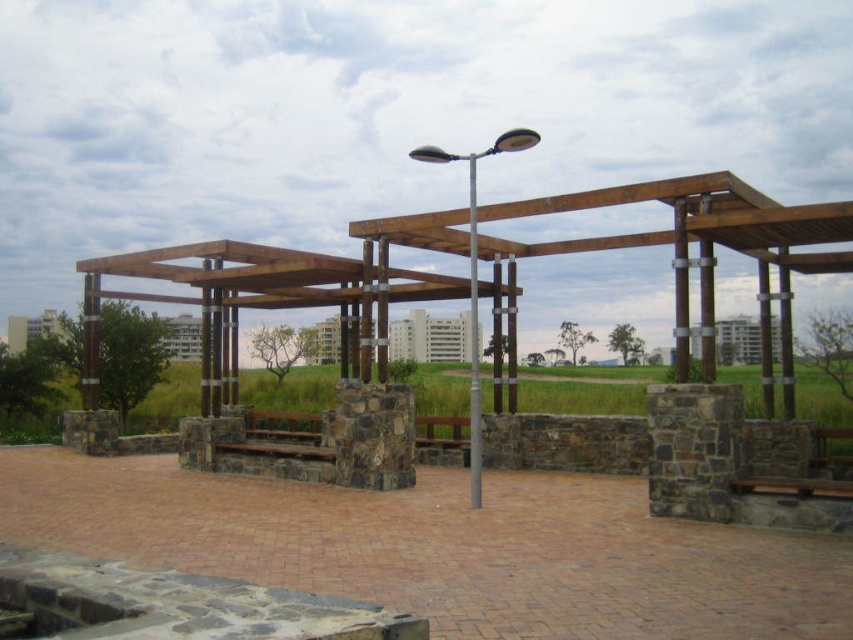
Question: Which of the following is the farthest from the observer?

Choices:
 (A) brown wooden bench at center
 (B) wooden bench at center
 (C) metallic pole at center

Answer: (A)

Question: Does brown wooden bench at center have a lesser width compared to wooden bench at center?

Choices:
 (A) yes
 (B) no

Answer: (A)

Question: Which object is closer to the camera taking this photo?

Choices:
 (A) brown wooden bench at center
 (B) wooden bench at center
 (C) metallic pole at center

Answer: (C)

Question: Can you confirm if brown wooden bench at center is positioned below wooden bench at center?

Choices:
 (A) yes
 (B) no

Answer: (A)

Question: Which of the following is the farthest from the observer?

Choices:
 (A) wooden bench at center
 (B) brown wooden bench at center
 (C) metallic pole at center

Answer: (B)

Question: Does brown wooden bench at center appear under wooden bench at center?

Choices:
 (A) no
 (B) yes

Answer: (B)